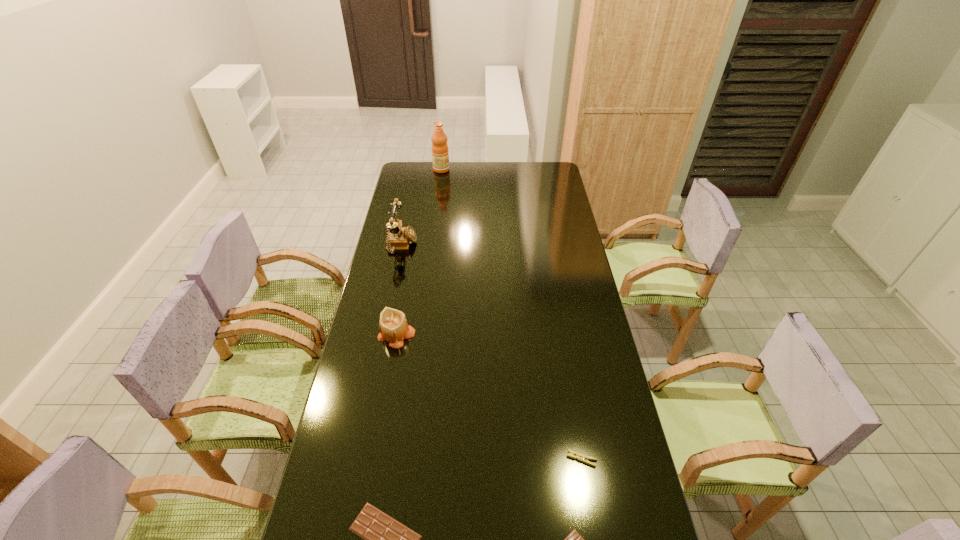
Find the location of a particular element. The height and width of the screenshot is (540, 960). unoccupied position between the candle and the third nearest object is located at coordinates (489, 397).

Identify the location of vacant region between the telephone and the fruit juice. (421, 208).

I want to click on empty location between the fifth nearest object and the tallest object, so 421,208.

At what (x,y) coordinates should I click in order to perform the action: click on free point between the fourth farthest object and the fruit juice. Please return your answer as a coordinate pair (x, y). Image resolution: width=960 pixels, height=540 pixels. Looking at the image, I should click on (512, 314).

Where is `vacant space that's between the fifth nearest object and the third tallest object`? This screenshot has height=540, width=960. vacant space that's between the fifth nearest object and the third tallest object is located at coordinates tap(399, 291).

Identify which object is the fourth closest to the shorter chocolate bar. Please provide its 2D coordinates. Your answer should be formatted as a tuple, i.e. [(x, y)], where the tuple contains the x and y coordinates of a point satisfying the conditions above.

[(398, 238)]

Locate which object is the fifth closest to the fourth tallest object. Please provide its 2D coordinates. Your answer should be formatted as a tuple, i.e. [(x, y)], where the tuple contains the x and y coordinates of a point satisfying the conditions above.

[(440, 156)]

Identify the location of vacant region that satisfies the following two spatial constraints: 1. on the back side of the clothespin; 2. on the label side of the fruit juice. (532, 170).

Locate an element on the screen. free space that satisfies the following two spatial constraints: 1. on the dial number of the telephone; 2. on the left side of the third farthest object is located at coordinates (383, 336).

Identify the location of vacant space that satisfies the following two spatial constraints: 1. on the label side of the farthest object; 2. on the front side of the third tallest object. (420, 336).